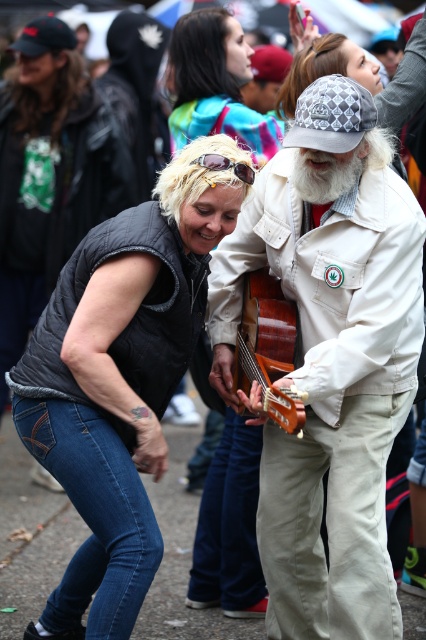
Question: Which point is farther from the camera taking this photo?

Choices:
 (A) (238, 163)
 (B) (284, 424)
 (C) (334, 161)

Answer: (C)

Question: Can you confirm if denim vest at lower left is wider than gold reflective sunglasses at upper center?

Choices:
 (A) yes
 (B) no

Answer: (A)

Question: Which is nearer to the white cotton jacket at center?

Choices:
 (A) wooden acoustic guitar at center
 (B) gold reflective sunglasses at upper center

Answer: (A)

Question: Considering the real-world distances, which object is closest to the multicolored fabric at upper center?

Choices:
 (A) white cotton jacket at center
 (B) gold reflective sunglasses at upper center
 (C) whitewoollybeard at center
 (D) wooden acoustic guitar at center

Answer: (C)

Question: Is white cotton jacket at center above gold reflective sunglasses at upper center?

Choices:
 (A) yes
 (B) no

Answer: (B)

Question: Does denim vest at lower left have a larger size compared to wooden acoustic guitar at center?

Choices:
 (A) yes
 (B) no

Answer: (A)